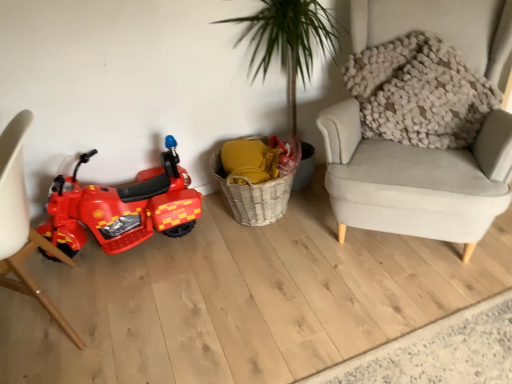
The height and width of the screenshot is (384, 512). Identify the location of free space in front of woven basket at center. (271, 263).